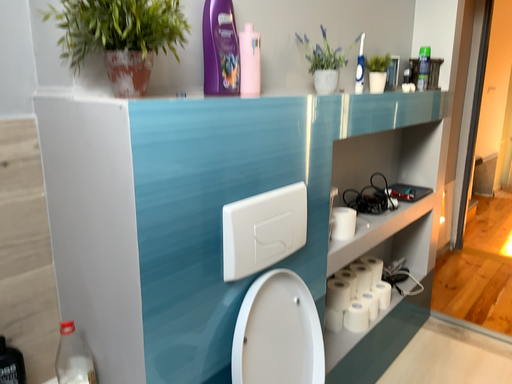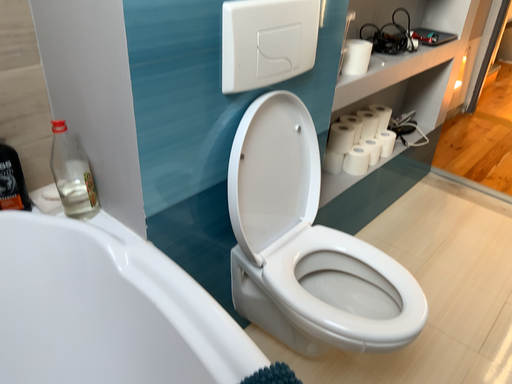
Question: Which way did the camera rotate in the video?

Choices:
 (A) rotated downward
 (B) rotated upward

Answer: (A)